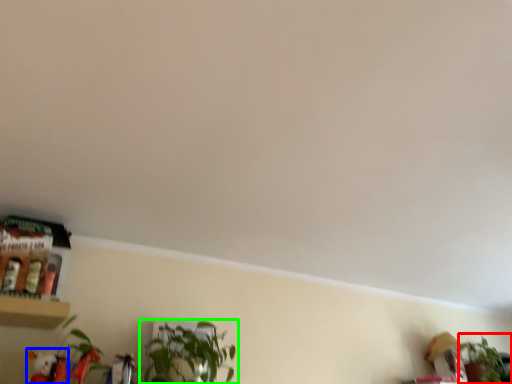
Question: Based on their relative distances, which object is farther from houseplant (highlighted by a red box)? Choose from toy (highlighted by a blue box) and houseplant (highlighted by a green box).

Choices:
 (A) toy
 (B) houseplant

Answer: (A)